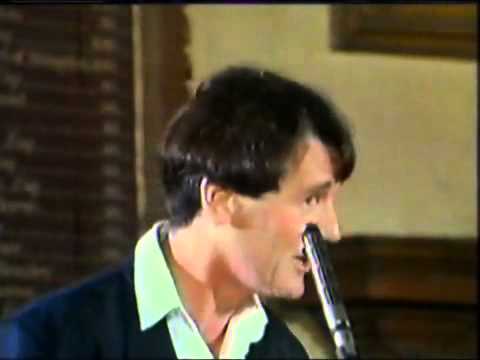
You are a GUI agent. You are given a task and a screenshot of the screen. Output one action in this format:
    pyautogui.click(x=<x>, y=<y>)
    Task: Click on the picture
    Image resolution: width=480 pixels, height=360 pixels.
    Given the screenshot: What is the action you would take?
    pyautogui.click(x=412, y=19)